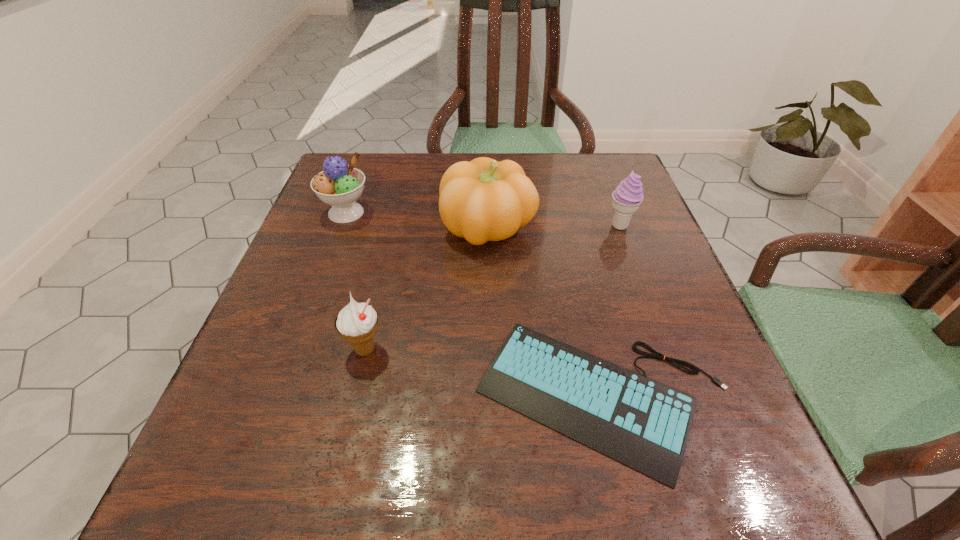
I want to click on vacant space located 0.250m on the back of the shortest object, so click(567, 238).

The image size is (960, 540). I want to click on pumpkin present at the far edge, so [483, 200].

This screenshot has width=960, height=540. Identify the location of icecream situated at the far edge. (339, 185).

I want to click on object that is at the near edge, so click(644, 424).

You are a GUI agent. You are given a task and a screenshot of the screen. Output one action in this format:
    pyautogui.click(x=<x>, y=<y>)
    Task: Click on the icecream located at the right edge
    The height and width of the screenshot is (540, 960).
    Given the screenshot: What is the action you would take?
    pyautogui.click(x=627, y=197)

Where is `computer keyboard that is positioned at the right edge`? computer keyboard that is positioned at the right edge is located at coordinates (644, 424).

Locate an element on the screen. object positioned at the far left corner is located at coordinates (339, 185).

The width and height of the screenshot is (960, 540). Identify the location of object that is positioned at the near right corner. (644, 424).

In the image, there is a desktop. Find the location of `free space at the far edge`. free space at the far edge is located at coordinates (418, 153).

Locate an element on the screen. vacant space at the near edge of the desktop is located at coordinates (308, 512).